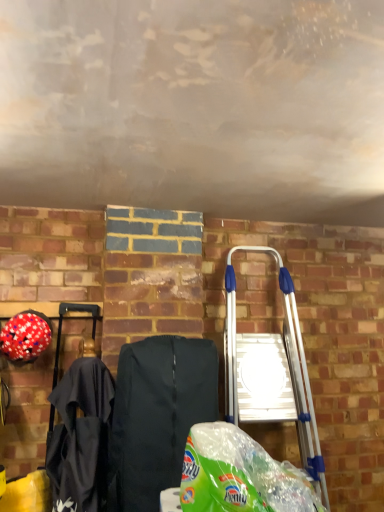
Question: From the image's perspective, is black fabric folding chair at center located above or below red matte helmet at left?

Choices:
 (A) above
 (B) below

Answer: (B)

Question: In terms of height, does black fabric folding chair at center look taller or shorter compared to red matte helmet at left?

Choices:
 (A) short
 (B) tall

Answer: (B)

Question: Which of these objects is positioned farthest from the silver metallic ladder at right?

Choices:
 (A) red matte helmet at left
 (B) black fabric folding chair at center
 (C) green plastic grocery bag at lower center

Answer: (A)

Question: Estimate the real-world distances between objects in this image. Which object is closer to the red matte helmet at left?

Choices:
 (A) silver metallic ladder at right
 (B) black fabric folding chair at center
 (C) green plastic grocery bag at lower center

Answer: (B)